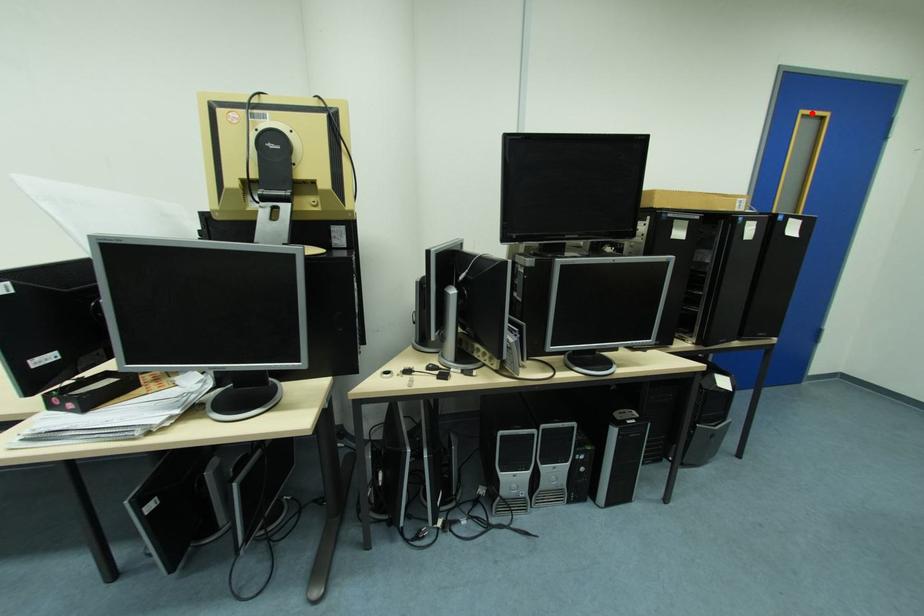
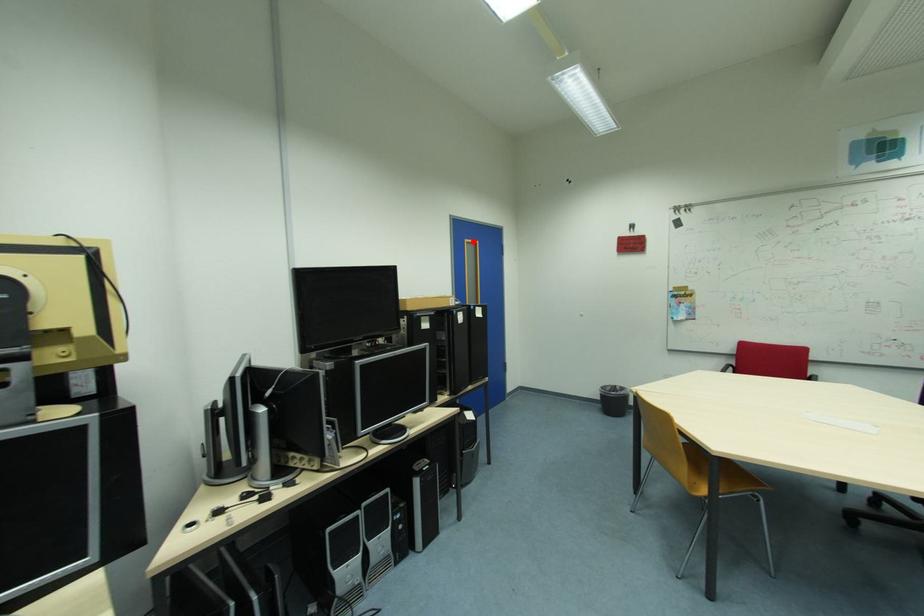
I am providing you with two images of the same scene from different viewpoints. A red point is marked on the first image and another point is marked on the second image. Is the red point in image1 aligned with the point shown in image2?

Yes